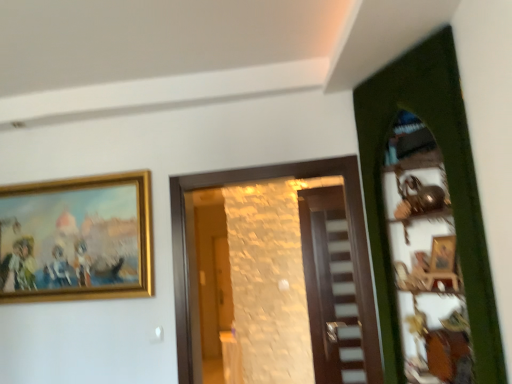
Question: Is matte wooden door at center, marked as the third door in a front-to-back arrangement, next to wooden door at center, which ranks as the 2th door in back-to-front order, and touching it?

Choices:
 (A) yes
 (B) no

Answer: (B)

Question: Does matte wooden door at center, which is the 1th door from back to front, have a lesser width compared to wooden door at center, which ranks as the 2th door in back-to-front order?

Choices:
 (A) no
 (B) yes

Answer: (B)

Question: Can you confirm if matte wooden door at center, which is the 1th door from back to front, is bigger than wooden door at center, which ranks as the 2th door in back-to-front order?

Choices:
 (A) no
 (B) yes

Answer: (A)

Question: Is matte wooden door at center, which is the 1th door from back to front, closer to camera compared to wooden door at center, which ranks as the 2th door in back-to-front order?

Choices:
 (A) no
 (B) yes

Answer: (A)

Question: Is matte wooden door at center, which is the 1th door from back to front, to the left of wooden door at center, which ranks as the 2th door in back-to-front order, from the viewer's perspective?

Choices:
 (A) yes
 (B) no

Answer: (B)

Question: From a real-world perspective, is wooden door at center, which ranks as the second door in front-to-back order, positioned above or below green wooden door at right, the third door in the back-to-front sequence?

Choices:
 (A) below
 (B) above

Answer: (A)

Question: Relative to green wooden door at right, the 1th door from the front, is wooden door at center, which ranks as the second door in front-to-back order, in front or behind?

Choices:
 (A) behind
 (B) front

Answer: (A)

Question: Considering the positions of wooden door at center, which ranks as the 2th door in back-to-front order, and green wooden door at right, the third door in the back-to-front sequence, in the image, is wooden door at center, which ranks as the 2th door in back-to-front order, bigger or smaller than green wooden door at right, the third door in the back-to-front sequence,?

Choices:
 (A) big
 (B) small

Answer: (B)

Question: Is wooden door at center, which ranks as the second door in front-to-back order, spatially inside green wooden door at right, the 1th door from the front, or outside of it?

Choices:
 (A) inside
 (B) outside

Answer: (B)

Question: Considering their positions, is wooden door at center, which ranks as the 2th door in back-to-front order, located in front of or behind matte wooden door at center, which is the 1th door from back to front?

Choices:
 (A) behind
 (B) front

Answer: (B)

Question: From the image's perspective, is wooden door at center, which ranks as the second door in front-to-back order, positioned above or below matte wooden door at center, marked as the third door in a front-to-back arrangement?

Choices:
 (A) below
 (B) above

Answer: (B)

Question: Which is correct: wooden door at center, which ranks as the 2th door in back-to-front order, is inside matte wooden door at center, marked as the third door in a front-to-back arrangement, or outside of it?

Choices:
 (A) inside
 (B) outside

Answer: (B)

Question: In the image, is wooden door at center, which ranks as the 2th door in back-to-front order, on the left side or the right side of matte wooden door at center, which is the 1th door from back to front?

Choices:
 (A) left
 (B) right

Answer: (A)

Question: Is matte wooden door at center, marked as the third door in a front-to-back arrangement, to the left or to the right of wooden door at center, which ranks as the second door in front-to-back order, in the image?

Choices:
 (A) left
 (B) right

Answer: (B)

Question: Looking at the image, does matte wooden door at center, marked as the third door in a front-to-back arrangement, seem bigger or smaller compared to wooden door at center, which ranks as the 2th door in back-to-front order?

Choices:
 (A) small
 (B) big

Answer: (A)